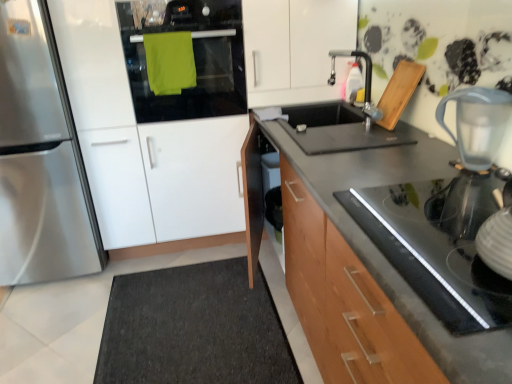
Question: Does green matte oven at upper left have a smaller size compared to metallic faucet at upper right?

Choices:
 (A) no
 (B) yes

Answer: (A)

Question: Is green matte oven at upper left to the left of metallic faucet at upper right from the viewer's perspective?

Choices:
 (A) yes
 (B) no

Answer: (A)

Question: Can you confirm if green matte oven at upper left is taller than metallic faucet at upper right?

Choices:
 (A) no
 (B) yes

Answer: (B)

Question: From a real-world perspective, is green matte oven at upper left on top of metallic faucet at upper right?

Choices:
 (A) no
 (B) yes

Answer: (B)

Question: Are green matte oven at upper left and metallic faucet at upper right making contact?

Choices:
 (A) no
 (B) yes

Answer: (A)

Question: Would you say green matte oven at upper left is outside metallic faucet at upper right?

Choices:
 (A) no
 (B) yes

Answer: (B)

Question: Does green matte oven at upper left touch satin silver refrigerator at left?

Choices:
 (A) yes
 (B) no

Answer: (B)

Question: Is green matte oven at upper left completely or partially outside of satin silver refrigerator at left?

Choices:
 (A) yes
 (B) no

Answer: (A)

Question: Does green matte oven at upper left lie behind satin silver refrigerator at left?

Choices:
 (A) no
 (B) yes

Answer: (B)

Question: Is green matte oven at upper left bigger than satin silver refrigerator at left?

Choices:
 (A) no
 (B) yes

Answer: (A)

Question: From the image's perspective, is green matte oven at upper left below satin silver refrigerator at left?

Choices:
 (A) yes
 (B) no

Answer: (B)

Question: Can you confirm if green matte oven at upper left is taller than satin silver refrigerator at left?

Choices:
 (A) no
 (B) yes

Answer: (A)

Question: Can you confirm if dark gray carpet at lower left is smaller than green matte oven at upper left?

Choices:
 (A) no
 (B) yes

Answer: (A)